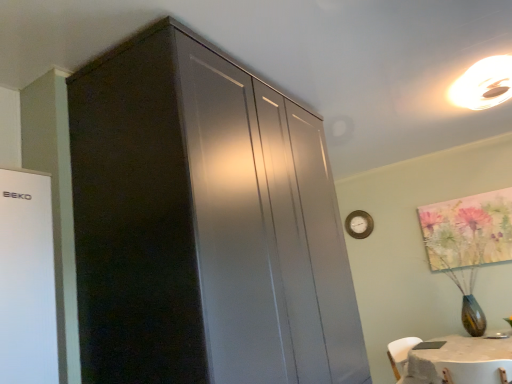
Locate an element on the screen. The height and width of the screenshot is (384, 512). free point above watercolor floral painting at upper right (from a real-world perspective) is located at coordinates (468, 193).